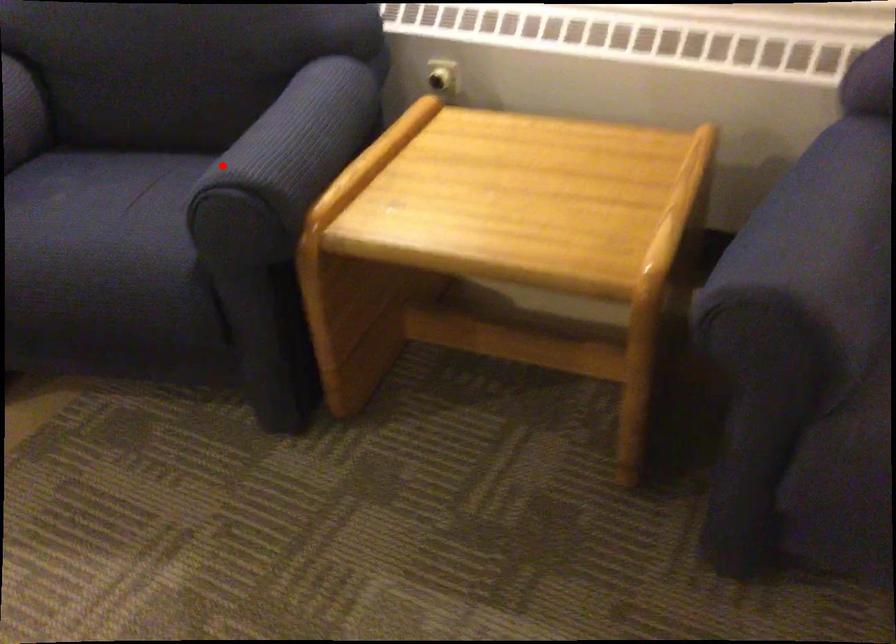
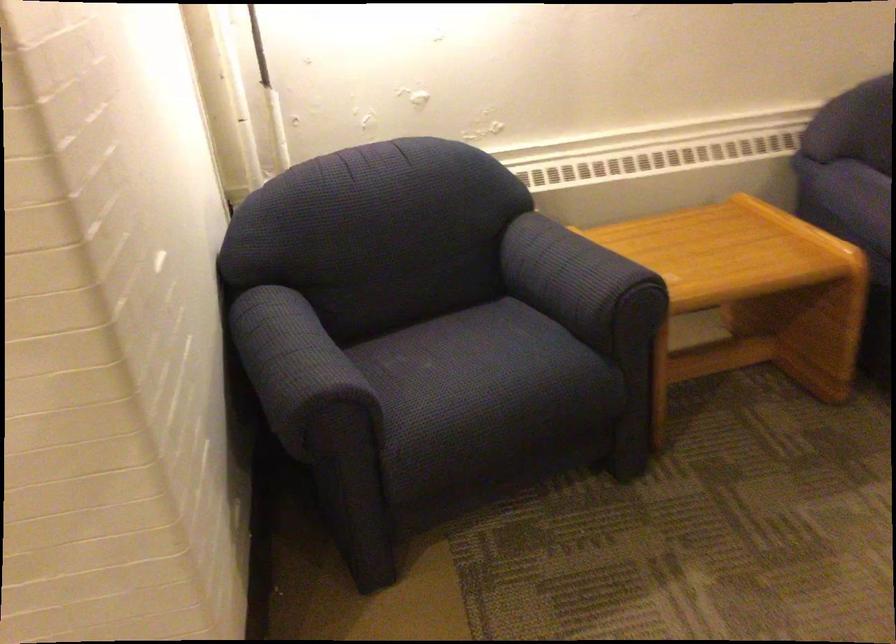
Question: I am providing you with two images of the same scene from different viewpoints. Given a red point in image1, look at the same physical point in image2. Is it:

Choices:
 (A) Closer to the viewpoint
 (B) Farther from the viewpoint

Answer: (B)